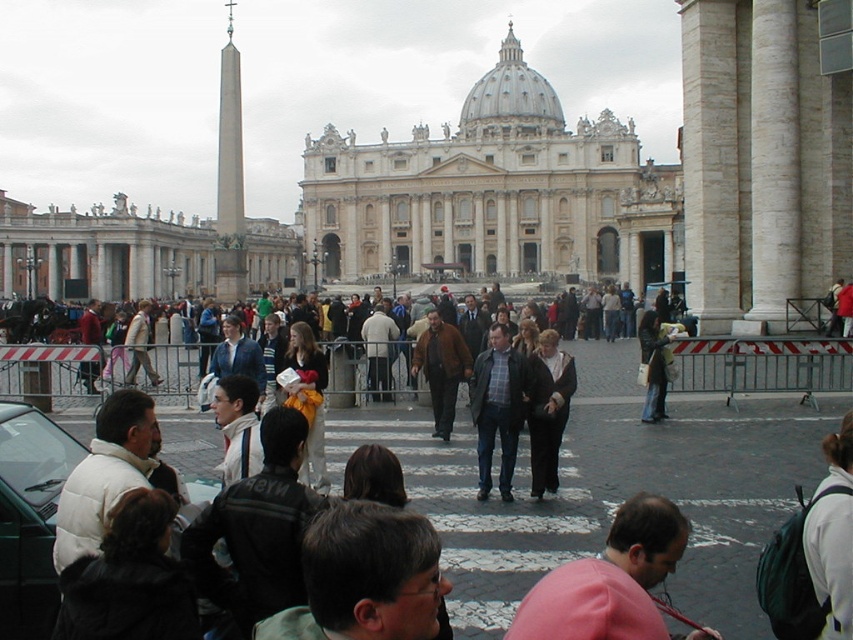
You are a photographer standing in front of St. Peter Basilica. You want to take a photo of the two jackets, dark gray jacket at lower left and dark brown jacket at lower left. Which jacket should you focus on if you want to capture the one that is taller?

The dark gray jacket at lower left is taller than the dark brown jacket at lower left, so you should focus on the dark gray jacket at lower left.

You are a tourist standing in front of St. Peter Basilica and you have both the yellow fabric bag at center and the leather jacket at center with you. You want to store your passport and a small camera in one of them. Which item would you choose based on their sizes?

The yellow fabric bag at center is bigger than the leather jacket at center, so you should choose the yellow fabric bag at center to store your passport and small camera as it has more space.